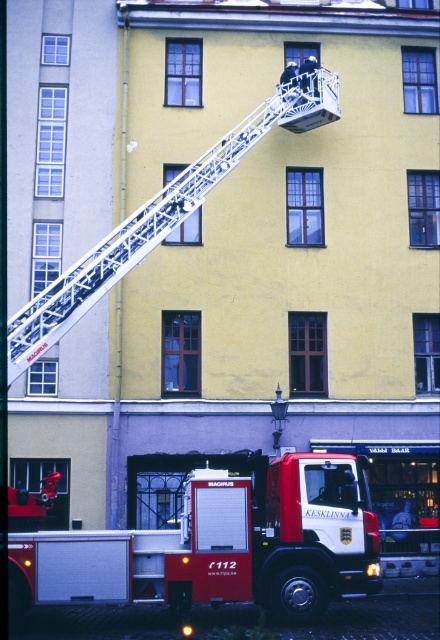
Based on the photo, you are a firefighter trying to assess the situation. You see the red matte fire truck at lower left and the white metallic ladder at upper center. Which object is wider?

The white metallic ladder at upper center is wider than the red matte fire truck at lower left.

You are a firefighter assessing the scene. You need to determine if there is enough space to maneuver the red matte fire truck at lower left around the white metallic ladder at upper center. Based on their sizes, can you confirm if the fire truck is smaller than the ladder?

The red matte fire truck at lower left occupies less space than white metallic ladder at upper center, so yes, the fire truck is smaller and can be maneuvered around the ladder.

You are standing at the point marked as point (223, 545) in the image. What object are you currently standing on?

You are standing on the red matte fire truck at lower left.